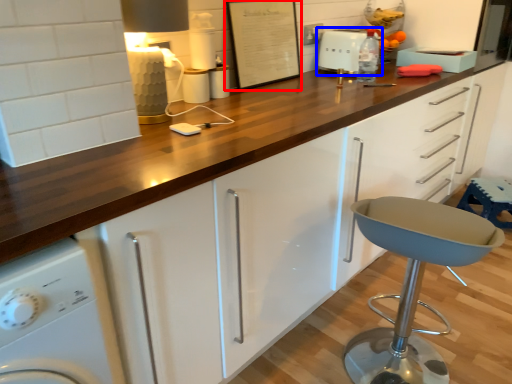
Question: Which object appears farthest to the camera in this image, bulletin board (highlighted by a red box) or toaster (highlighted by a blue box)?

Choices:
 (A) bulletin board
 (B) toaster

Answer: (B)